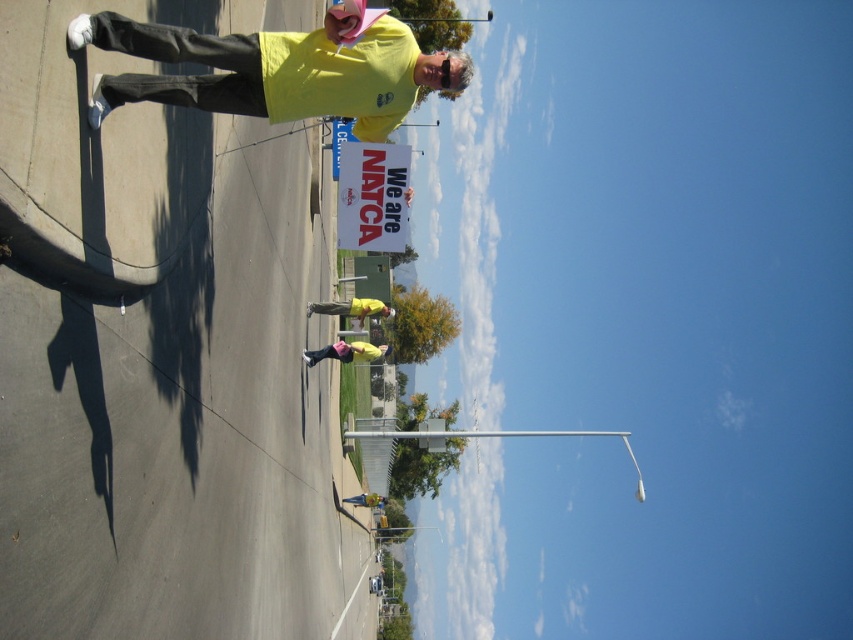
Which is behind, point (373, 307) or point (384, 500)?

The point (384, 500) is behind.

Between point (311, 312) and point (361, 493), which one is positioned behind?

The point (361, 493) is behind.

At what (x,y) coordinates should I click in order to perform the action: click on yellow matte shirt at center. Please return your answer as a coordinate pair (x, y). Looking at the image, I should click on (352, 308).

Is yellow matte shirt at center in front of pink fabric at center?

No, it is behind pink fabric at center.

Which of these two, yellow matte shirt at center or pink fabric at center, stands taller?

Standing taller between the two is yellow matte shirt at center.

Between point (309, 307) and point (386, 349), which one is positioned in front?

Point (309, 307)

Find the location of a particular element. yellow matte shirt at center is located at coordinates (352, 308).

This screenshot has height=640, width=853. What do you see at coordinates (346, 352) in the screenshot?
I see `pink fabric at center` at bounding box center [346, 352].

I want to click on pink fabric at center, so click(346, 352).